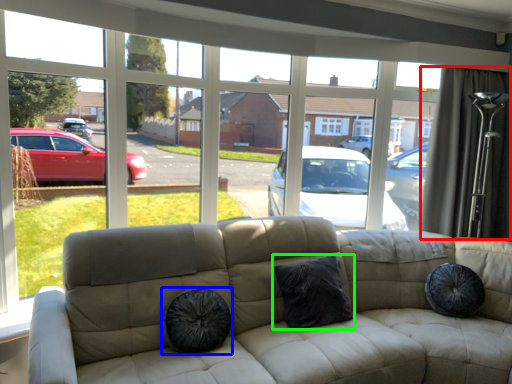
Question: Which object is the farthest from curtain (highlighted by a red box)? Choose among these: dog bed (highlighted by a blue box) or pillow (highlighted by a green box).

Choices:
 (A) dog bed
 (B) pillow

Answer: (A)